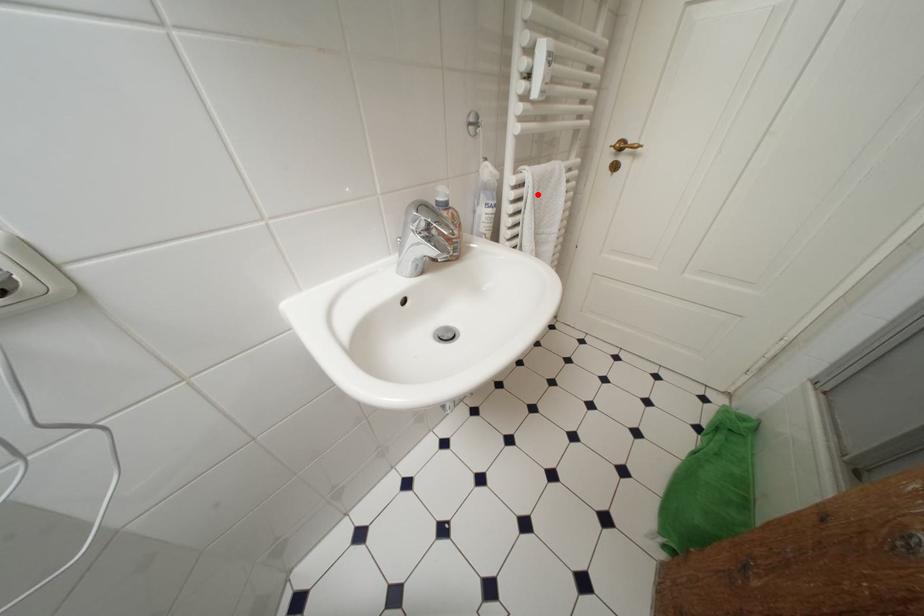
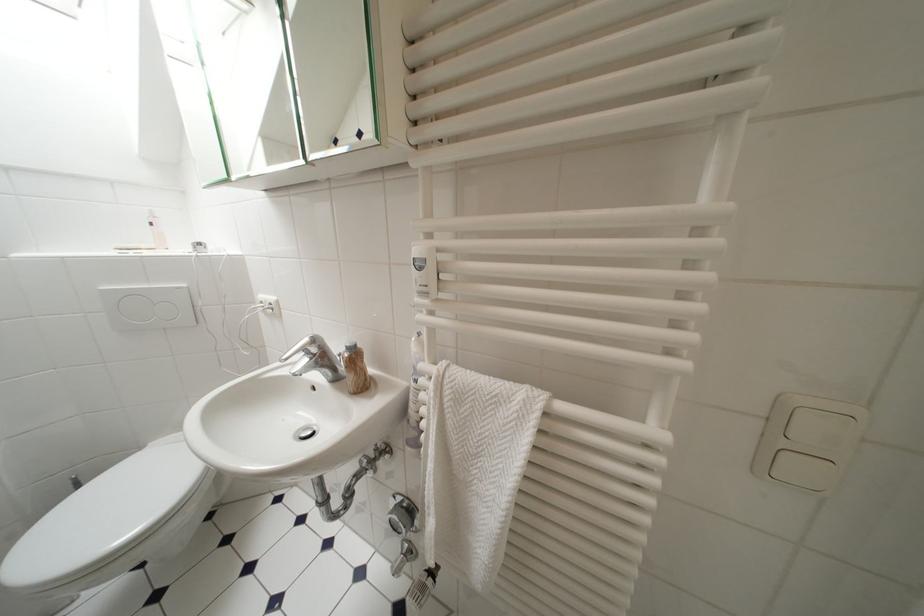
Find the pixel in the second image that matches the highlighted location in the first image.

(439, 397)